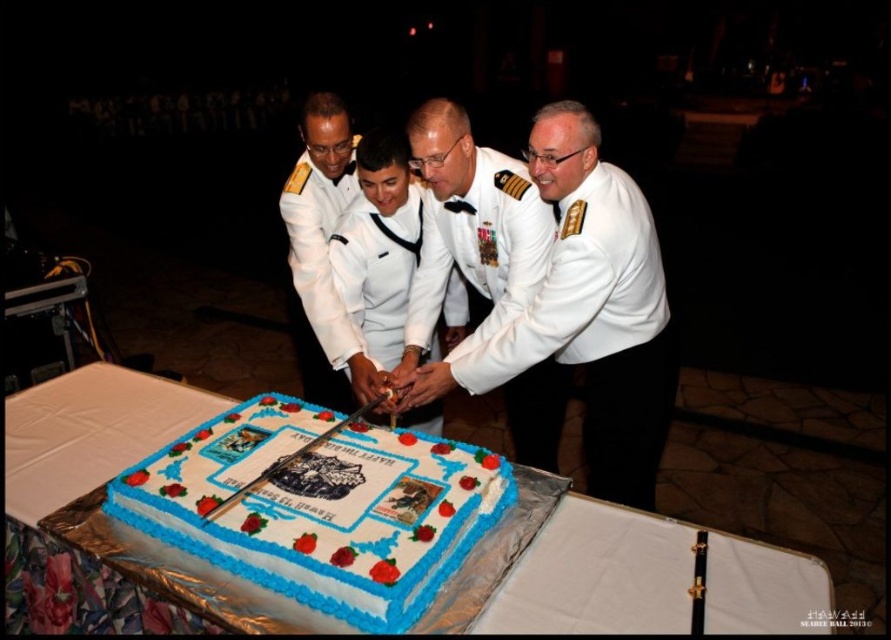
Question: Estimate the real-world distances between objects in this image. Which object is closer to the white uniform at center?

Choices:
 (A) white glossy cake at center
 (B) white matte uniform at center

Answer: (A)

Question: Is white glossy cake at center closer to the viewer compared to white uniform at center?

Choices:
 (A) yes
 (B) no

Answer: (A)

Question: Which point appears farthest from the camera in this image?

Choices:
 (A) (616, 426)
 (B) (421, 476)

Answer: (A)

Question: Is the position of white glossy cake at center less distant than that of white fondant cake at center?

Choices:
 (A) yes
 (B) no

Answer: (B)

Question: Is white glossy uniform at center above white uniform at center?

Choices:
 (A) yes
 (B) no

Answer: (B)

Question: Among these objects, which one is farthest from the camera?

Choices:
 (A) white glossy uniform at center
 (B) white uniform at center
 (C) white fondant cake at center
 (D) white smooth uniform at center

Answer: (D)